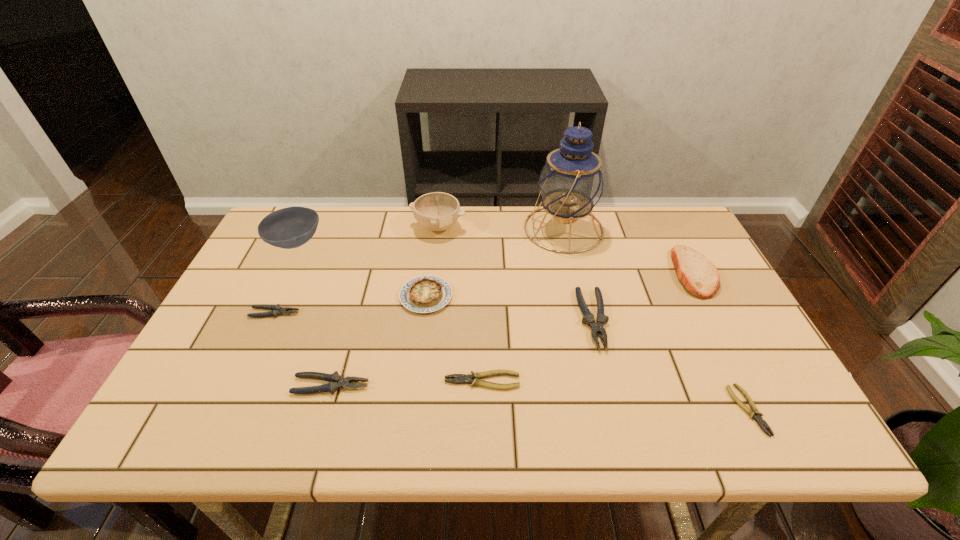
This screenshot has height=540, width=960. Find the location of `free region at the left edge of the desktop`. free region at the left edge of the desktop is located at coordinates (272, 262).

You are a GUI agent. You are given a task and a screenshot of the screen. Output one action in this format:
    pyautogui.click(x=<x>, y=<y>)
    Task: Click on the blank space at the right edge of the desktop
    
    Given the screenshot: What is the action you would take?
    click(683, 316)

This screenshot has width=960, height=540. What are the coordinates of `vacant region at the far right corner of the desktop` in the screenshot? It's located at (678, 242).

Where is `empty space between the second tallest pliers and the shortest pliers`? The height and width of the screenshot is (540, 960). empty space between the second tallest pliers and the shortest pliers is located at coordinates (540, 397).

The image size is (960, 540). Identify the location of vacant space that is in between the shortest object and the ninth tallest object. (614, 395).

You are a GUI agent. You are given a task and a screenshot of the screen. Output one action in this format:
    pyautogui.click(x=<x>, y=<y>)
    Task: Click on the free point between the lantern and the eighth object from right to left
    
    Given the screenshot: What is the action you would take?
    pyautogui.click(x=447, y=307)

This screenshot has height=540, width=960. I want to click on unoccupied position between the smaller yellow pliers and the brown bowl, so click(x=521, y=326).

At what (x,y) coordinates should I click in order to perform the action: click on empty location between the leftmost gray pliers and the seventh shortest object. Please return your answer as a coordinate pair (x, y). The image size is (960, 540). Looking at the image, I should click on (484, 293).

At what (x,y) coordinates should I click in order to perform the action: click on empty space between the second pliers from left to right and the left yellow pliers. Please return your answer as a coordinate pair (x, y). The height and width of the screenshot is (540, 960). Looking at the image, I should click on (406, 383).

Locate an element on the screen. The width and height of the screenshot is (960, 540). vacant area that lies between the beige bowl and the quiche is located at coordinates (432, 261).